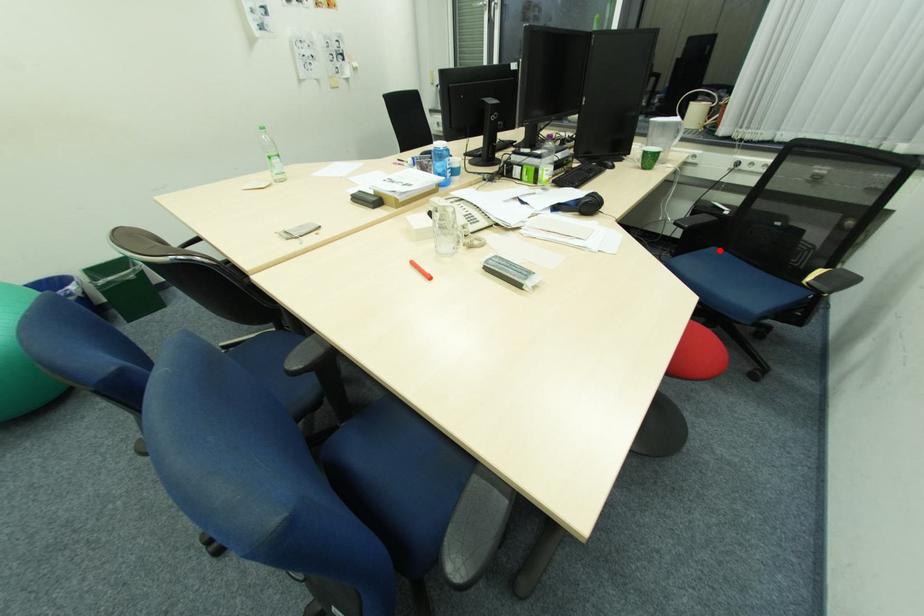
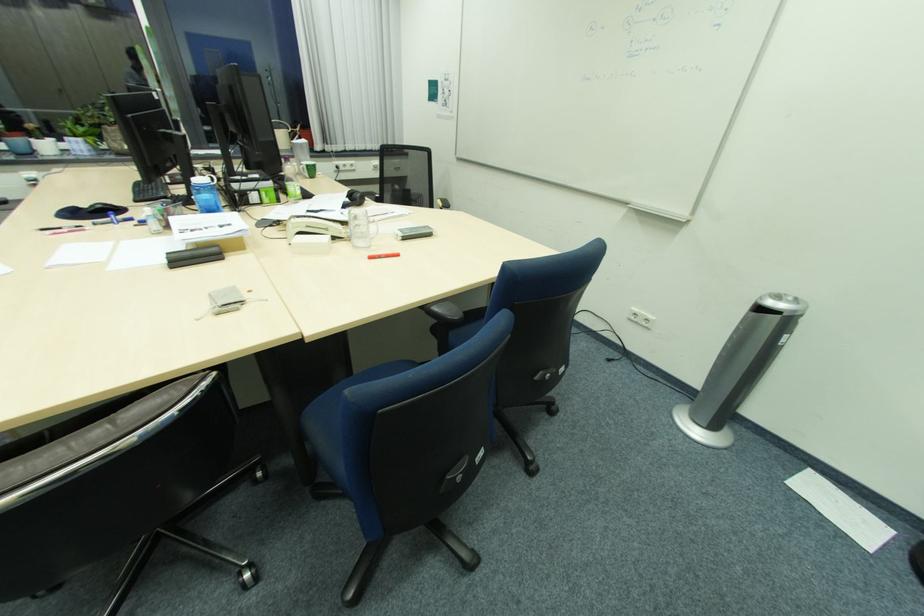
Question: I am providing you with two images of the same scene from different viewpoints. A red point is marked on the first image. At the location where the point appears in image 1, is it still visible in image 2?

Choices:
 (A) Yes
 (B) No

Answer: (B)